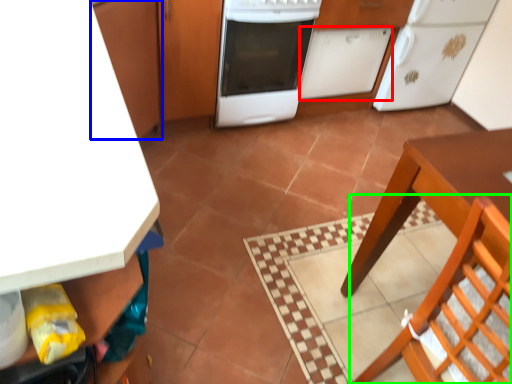
Question: Considering the real-world distances, which object is farthest from cabinetry (highlighted by a red box)? cabinetry (highlighted by a blue box) or chair (highlighted by a green box)?

Choices:
 (A) cabinetry
 (B) chair

Answer: (B)